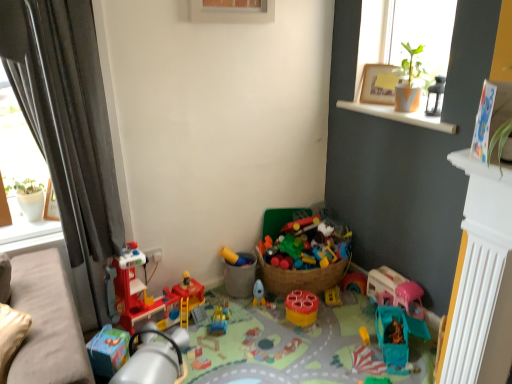
You are a GUI agent. You are given a task and a screenshot of the screen. Output one action in this format:
    pyautogui.click(x=<x>, y=<y>)
    Task: Click on the vacant area situated to the left side of matte yellow plastic toy at center, which ranks as the 4th toy in right-to-left order
    The image size is (512, 384).
    Given the screenshot: What is the action you would take?
    coord(215,296)